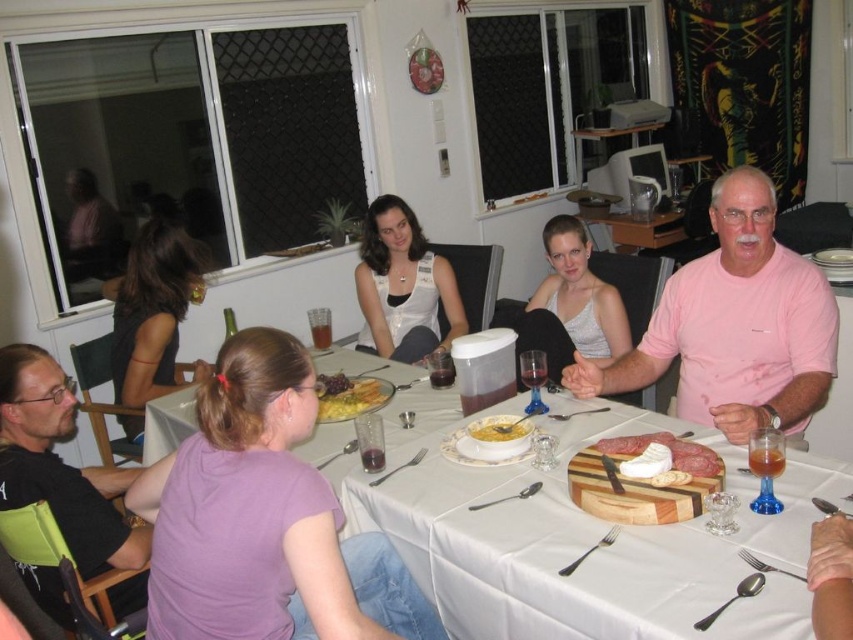
Does black t-shirt at left appear over matte white bowl at center?

Incorrect, black t-shirt at left is not positioned above matte white bowl at center.

Who is more forward, [142,538] or [483,440]?

Point [142,538]

Identify the location of black t-shirt at left. (61, 465).

Who is more distant from viewer, (x=326, y=566) or (x=514, y=436)?

Positioned behind is point (x=514, y=436).

In the scene shown: Can you confirm if purple cotton shirt at lower left is positioned to the left of yellow matte soup bowl at center?

Yes, purple cotton shirt at lower left is to the left of yellow matte soup bowl at center.

This screenshot has width=853, height=640. What do you see at coordinates (264, 518) in the screenshot? I see `purple cotton shirt at lower left` at bounding box center [264, 518].

I want to click on purple cotton shirt at lower left, so click(x=264, y=518).

Can you confirm if wooden cutting board with meat and cheese at center is wider than matte white bowl at center?

Yes, wooden cutting board with meat and cheese at center is wider than matte white bowl at center.

The height and width of the screenshot is (640, 853). I want to click on wooden cutting board with meat and cheese at center, so click(643, 481).

Who is more distant from viewer, (x=676, y=493) or (x=496, y=440)?

Point (x=496, y=440)

At what (x,y) coordinates should I click in order to perform the action: click on wooden cutting board with meat and cheese at center. Please return your answer as a coordinate pair (x, y). Looking at the image, I should click on (643, 481).